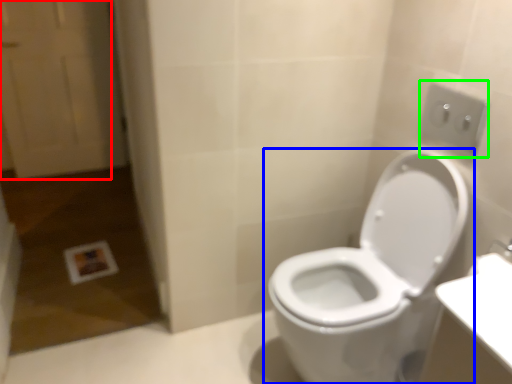
Question: Which is nearer to the screen door (highlighted by a red box)? toilet (highlighted by a blue box) or electric outlet (highlighted by a green box).

Choices:
 (A) toilet
 (B) electric outlet

Answer: (A)